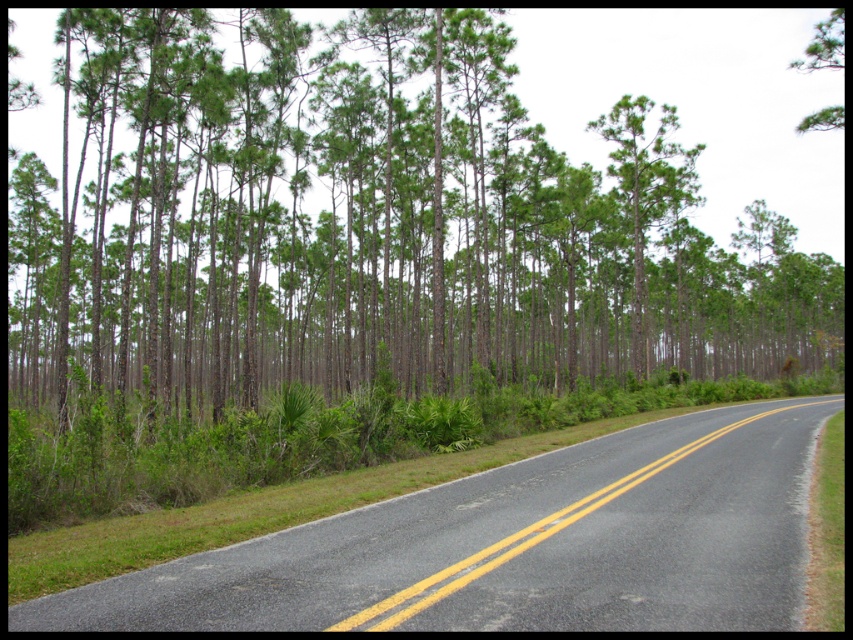
Who is positioned more to the right, green leafy trees at center or black asphalt road at center?

black asphalt road at center

Does point (257, 337) come closer to viewer compared to point (529, 490)?

No, it is behind (529, 490).

Find the location of a particular element. green leafy trees at center is located at coordinates (372, 225).